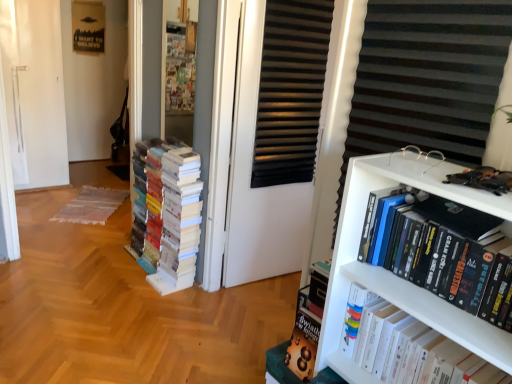
At what (x,y) coordinates should I click in order to perform the action: click on vacant space to the left of white paper books at left, which is the first book in left-to-right order. Please return your answer as a coordinate pair (x, y). This screenshot has height=384, width=512. Looking at the image, I should click on (82, 270).